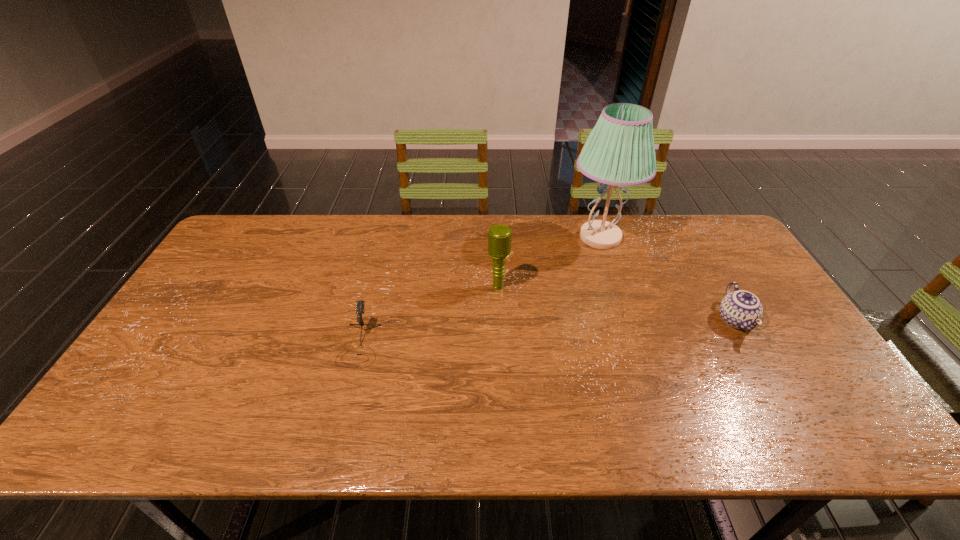
Identify the location of free spot that satisfies the following two spatial constraints: 1. on the back side of the third object from left to right; 2. on the right side of the right microphone. (496, 237).

Where is `free space that satisfies the following two spatial constraints: 1. on the back side of the right microphone; 2. on the left side of the tallest object`? Image resolution: width=960 pixels, height=540 pixels. free space that satisfies the following two spatial constraints: 1. on the back side of the right microphone; 2. on the left side of the tallest object is located at coordinates (496, 237).